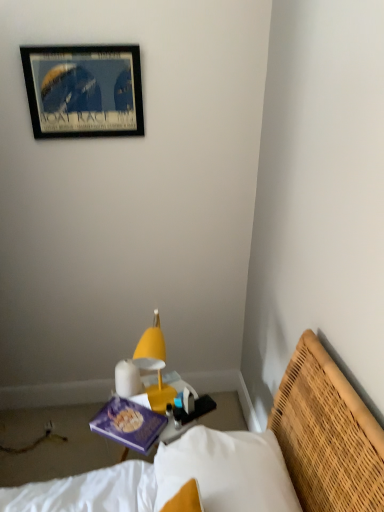
Question: Considering the relative sizes of purple matte book at center and yellow plastic lamp at center in the image provided, is purple matte book at center wider than yellow plastic lamp at center?

Choices:
 (A) no
 (B) yes

Answer: (B)

Question: Would you say purple matte book at center is outside yellow plastic lamp at center?

Choices:
 (A) yes
 (B) no

Answer: (A)

Question: From a real-world perspective, is purple matte book at center physically below yellow plastic lamp at center?

Choices:
 (A) no
 (B) yes

Answer: (B)

Question: Is purple matte book at center facing towards yellow plastic lamp at center?

Choices:
 (A) yes
 (B) no

Answer: (B)

Question: Can you confirm if purple matte book at center is smaller than yellow plastic lamp at center?

Choices:
 (A) yes
 (B) no

Answer: (A)

Question: Is purple matte book at center at the left side of yellow plastic lamp at center?

Choices:
 (A) no
 (B) yes

Answer: (B)

Question: Is wooden framed poster at upper left outside yellow woven bed at lower right?

Choices:
 (A) no
 (B) yes

Answer: (B)

Question: Is wooden framed poster at upper left smaller than yellow woven bed at lower right?

Choices:
 (A) no
 (B) yes

Answer: (B)

Question: Can you confirm if wooden framed poster at upper left is wider than yellow woven bed at lower right?

Choices:
 (A) yes
 (B) no

Answer: (B)

Question: Considering the relative sizes of wooden framed poster at upper left and yellow woven bed at lower right in the image provided, is wooden framed poster at upper left bigger than yellow woven bed at lower right?

Choices:
 (A) no
 (B) yes

Answer: (A)

Question: Is wooden framed poster at upper left next to yellow woven bed at lower right and touching it?

Choices:
 (A) yes
 (B) no

Answer: (B)

Question: Considering the relative positions of wooden framed poster at upper left and yellow woven bed at lower right in the image provided, is wooden framed poster at upper left behind yellow woven bed at lower right?

Choices:
 (A) yes
 (B) no

Answer: (A)

Question: Does yellow woven bed at lower right appear on the right side of wooden framed poster at upper left?

Choices:
 (A) no
 (B) yes

Answer: (B)